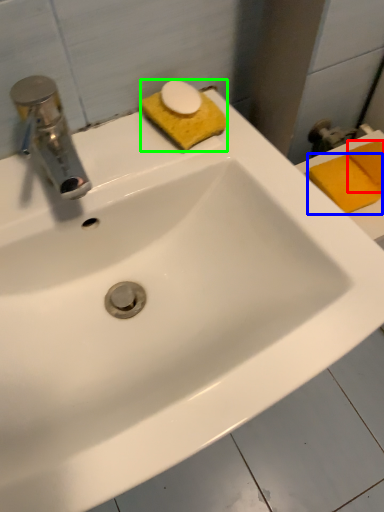
Question: Based on their relative distances, which object is farther from soap (highlighted by a red box)? Choose from soap (highlighted by a blue box) and soap (highlighted by a green box).

Choices:
 (A) soap
 (B) soap

Answer: (B)